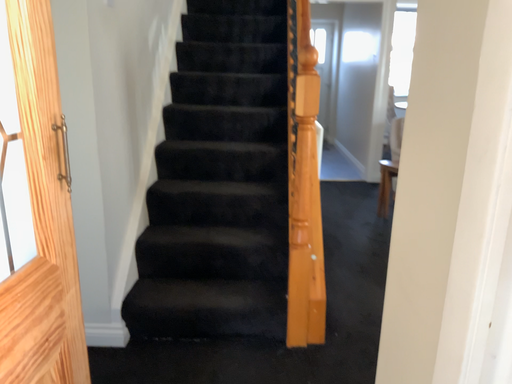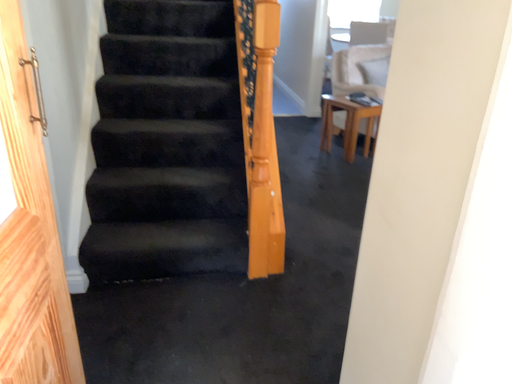
Question: How did the camera likely rotate when shooting the video?

Choices:
 (A) rotated left
 (B) rotated right

Answer: (B)